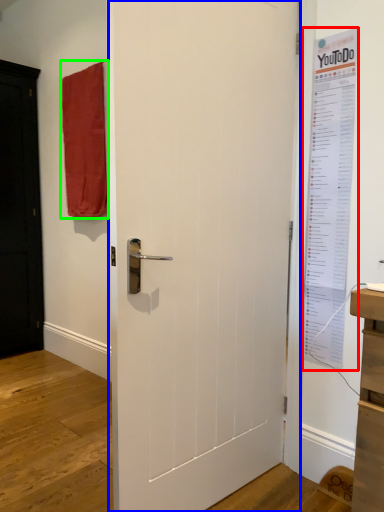
Question: Based on their relative distances, which object is farther from poster page (highlighted by a red box)? Choose from door (highlighted by a blue box) and curtain (highlighted by a green box).

Choices:
 (A) door
 (B) curtain

Answer: (B)